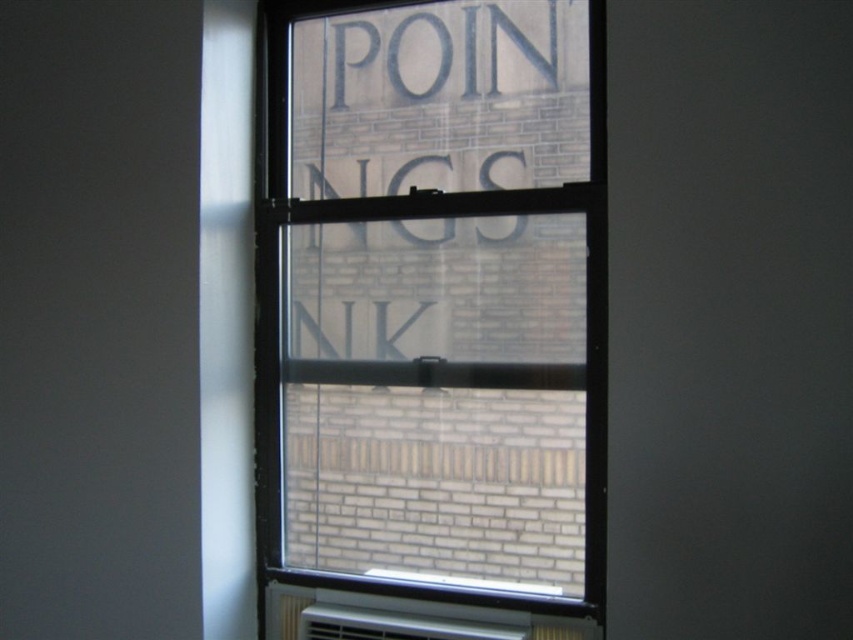
Consider the image. You are an interior designer assessing the room layout. You need to install a new shelf that requires at least 1.2 meters of vertical space. Given the clear glass window at center and the white plastic radiator at bottom, which object provides enough vertical space for the shelf?

The clear glass window at center is taller than the white plastic radiator at bottom, so the clear glass window at center provides enough vertical space for the shelf.

You are an interior designer planning to place a new decorative item on the white plastic radiator at bottom. Considering the clear glass window at center is wider than the radiator, where should you position the item to ensure it doesn not block the view through the window?

Since the clear glass window at center is wider than the white plastic radiator at bottom, placing the decorative item on the white plastic radiator at bottom towards the center would keep it from obstructing the view through the wider window.

You are an interior designer assessing the room layout. You need to place a new decorative shelf that must be wider than the white plastic radiator at bottom. Can the shelf be placed next to the clear glass window at center based on their sizes?

The clear glass window at center is larger in size than the white plastic radiator at bottom, so the decorative shelf can be placed next to the clear glass window at center as it is wider than the radiator.